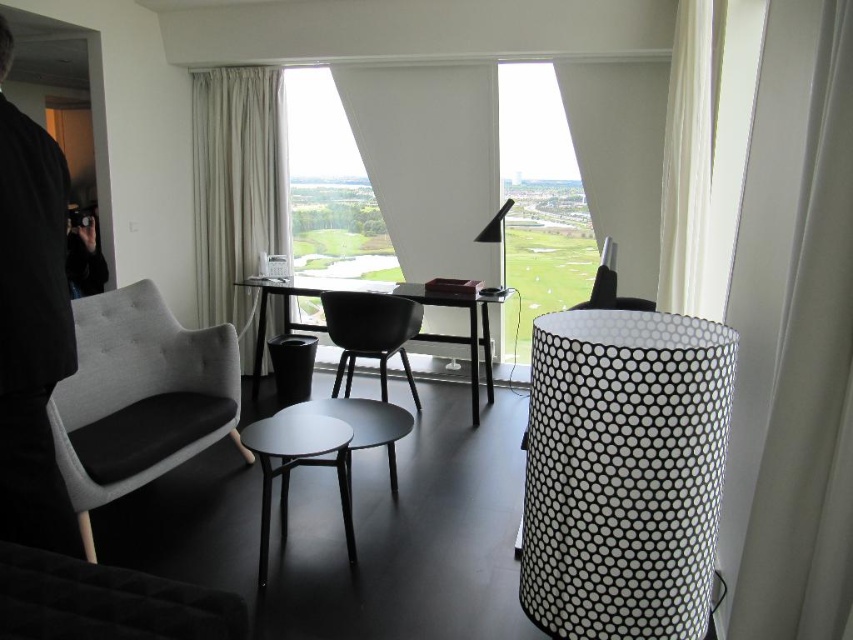
Question: Estimate the real-world distances between objects in this image. Which object is closer to the matte black chair at center?

Choices:
 (A) black matte stool at center
 (B) black fur coat at left

Answer: (A)

Question: Which point is farther from the camera taking this photo?

Choices:
 (A) (357, 397)
 (B) (505, 180)
 (C) (281, 472)

Answer: (B)

Question: Is black glossy table at center smaller than matte black chair at center?

Choices:
 (A) no
 (B) yes

Answer: (A)

Question: Can you confirm if black glossy table at center is positioned to the left of matte black stool at center?

Choices:
 (A) yes
 (B) no

Answer: (A)

Question: Is light gray fabric armchair at left wider than black glossy table at center?

Choices:
 (A) yes
 (B) no

Answer: (B)

Question: Which point is closer to the camera?

Choices:
 (A) black matte stool at center
 (B) transparent glass window at center
 (C) black fabric jacket at left

Answer: (C)